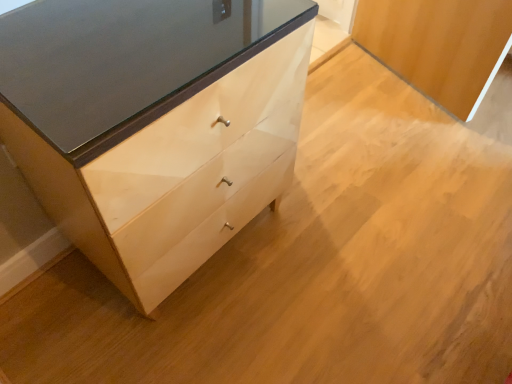
At what (x,y) coordinates should I click in order to perform the action: click on matte wood chest of drawers at lower left. Please return your answer as a coordinate pair (x, y). Image resolution: width=512 pixels, height=384 pixels. Looking at the image, I should click on (154, 125).

Measure the distance between point (184,174) and camera.

Point (184,174) and camera are 3.44 feet apart from each other.

Describe the element at coordinates (154, 125) in the screenshot. I see `matte wood chest of drawers at lower left` at that location.

Identify the location of matte wood chest of drawers at lower left. (154, 125).